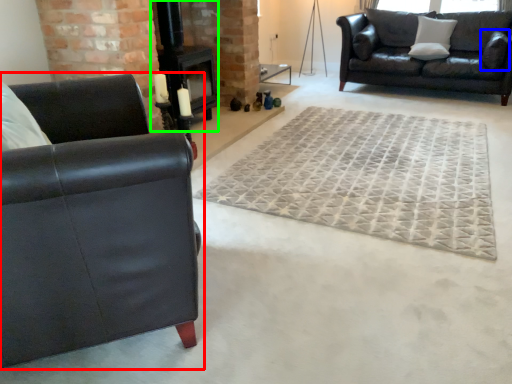
Question: Which object is positioned closest to studio couch (highlighted by a red box)? Select from pillow (highlighted by a blue box) and fireplace (highlighted by a green box).

Choices:
 (A) pillow
 (B) fireplace

Answer: (B)